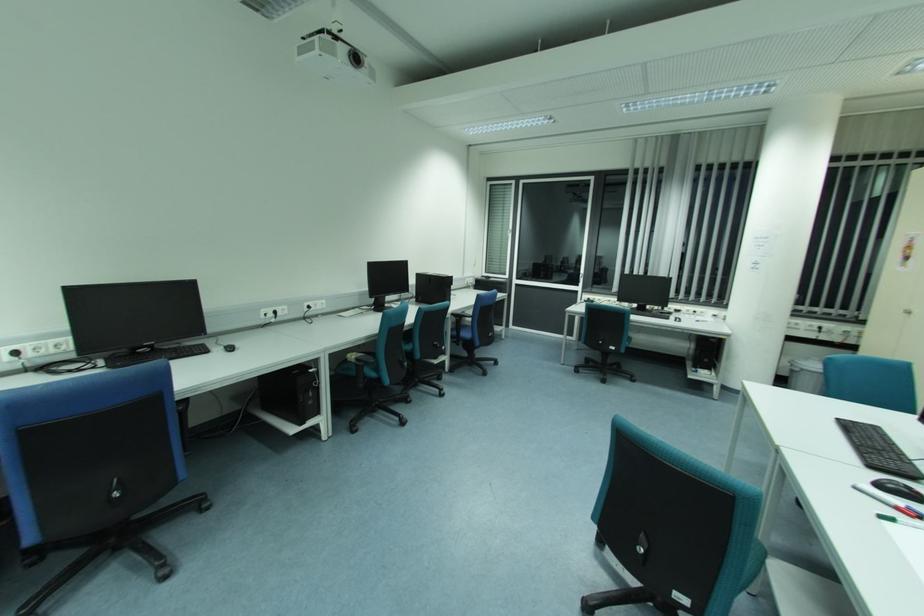
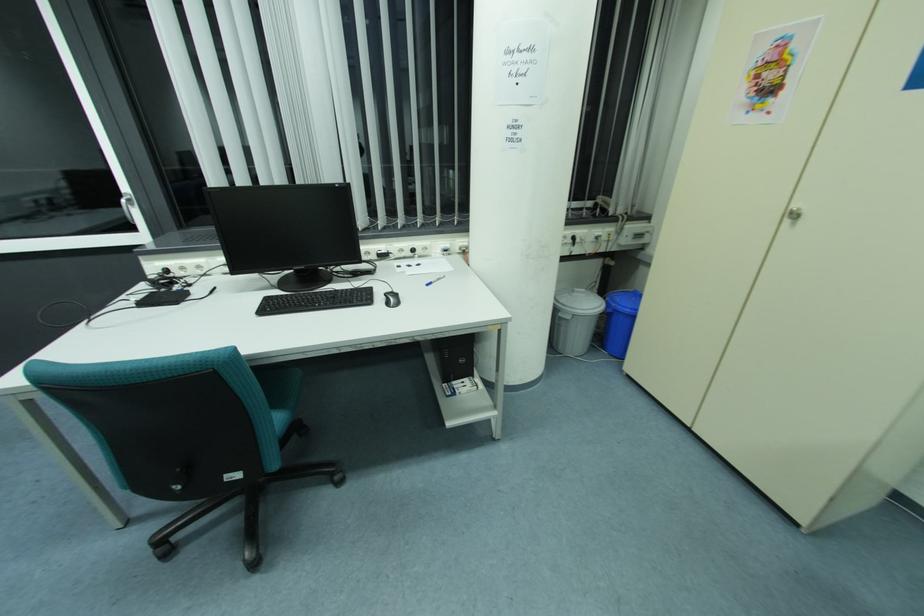
Question: I am providing you with two images of the same scene from different viewpoints. Which of the following objects are not visible in image2?

Choices:
 (A) silver cabinet knob
 (B) white window handle
 (C) blue pen
 (D) none of these

Answer: (D)